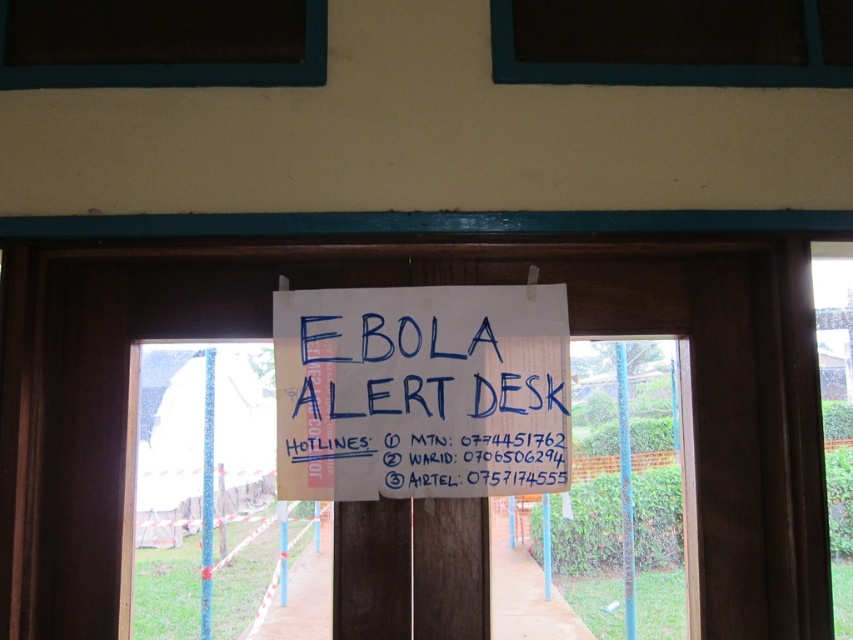
You are standing in front of the wooden door and want to read the blue handwritten sign at center. Can you see the dark glass window at upper center through the sign?

The blue handwritten sign at center is closer to the viewer than dark glass window at upper center, so the window cannot be seen through the sign.

You are a visitor at the EBOLA ALERT DESK and want to see the sign clearly. Which dark glass window should you stand closer to? The dark glass window at upper center or the dark glass window at upper left?

The dark glass window at upper center has a larger width than the dark glass window at upper left. To see the sign clearly, you should stand closer to the dark glass window at upper center because its larger size might provide better visibility.

You are standing in front of the wooden door and want to call the EBOLA ALERT DESK. You notice the blue handwritten sign at center and the dark glass window at upper left. Which object is closer to you?

The blue handwritten sign at center is closer to you than the dark glass window at upper left.